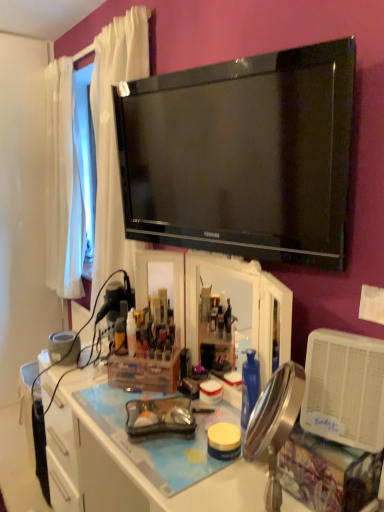
Find the location of a particular element. The image size is (384, 512). vacant space behind metallic gold mirror at center is located at coordinates (244, 493).